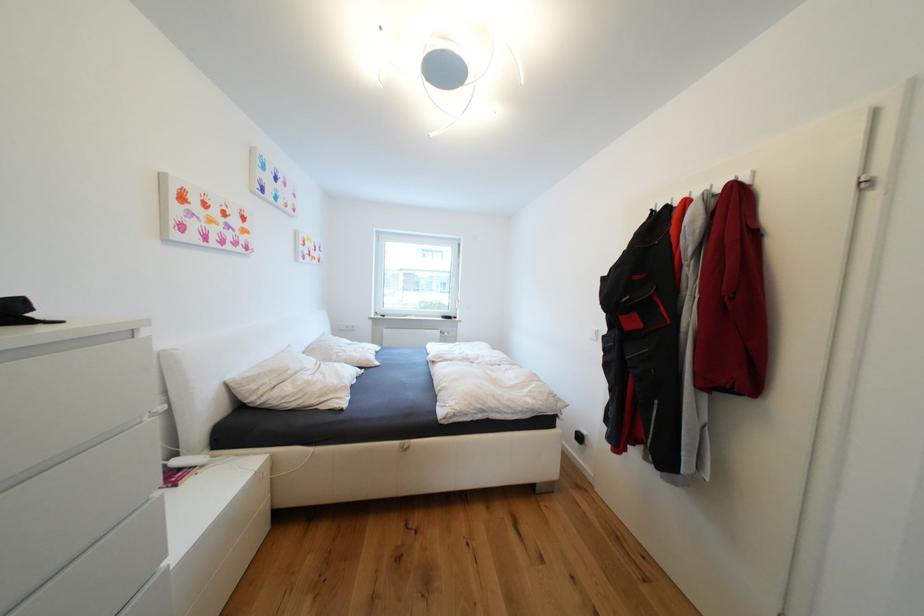
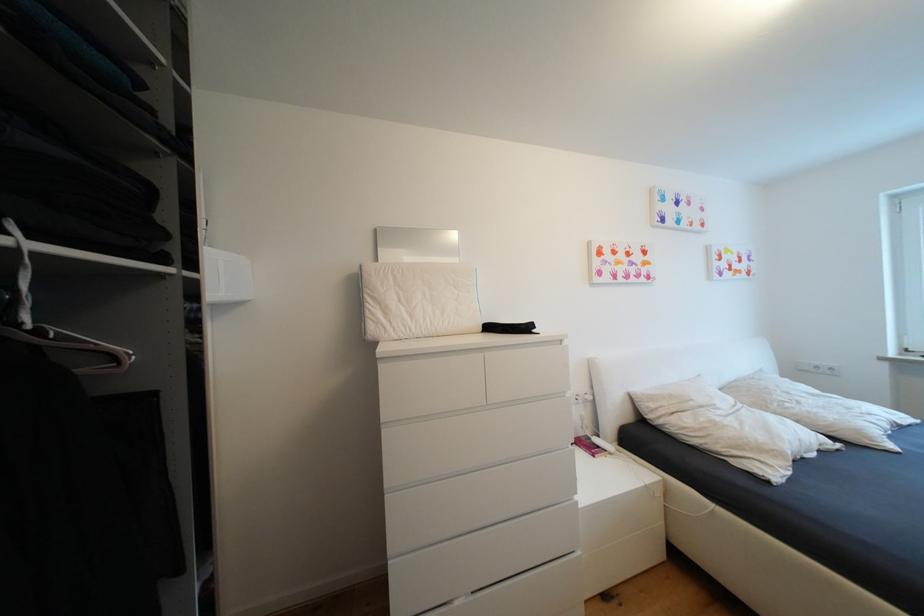
Question: The images are taken continuously from a first-person perspective. In which direction is your viewpoint rotating?

Choices:
 (A) Left
 (B) Right
 (C) Up
 (D) Down

Answer: (A)